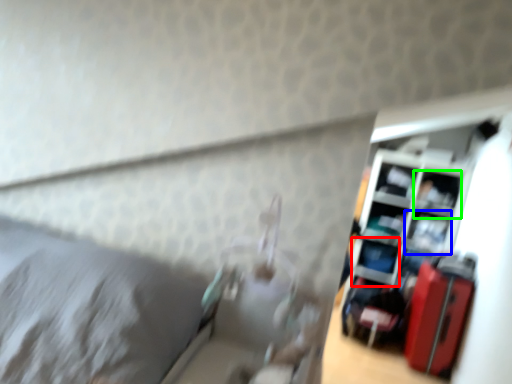
Question: Based on their relative distances, which object is nearer to shelf (highlighted by a red box)? Choose from shelf (highlighted by a blue box) and shelf (highlighted by a green box).

Choices:
 (A) shelf
 (B) shelf

Answer: (A)